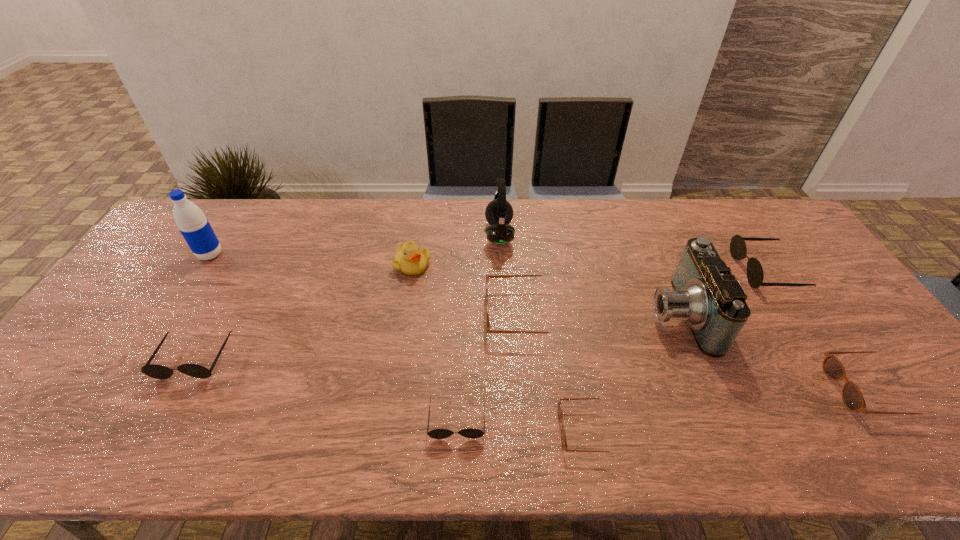
At what (x,y) coordinates should I click in order to perform the action: click on vacant space that's between the leftmost black sunglasses and the farthest black sunglasses. Please return your answer as a coordinate pair (x, y). The height and width of the screenshot is (540, 960). Looking at the image, I should click on (480, 314).

Where is `free space that is in between the rightmost black sunglasses and the duckling`? The height and width of the screenshot is (540, 960). free space that is in between the rightmost black sunglasses and the duckling is located at coordinates (588, 268).

Where is `free point between the biggest brown sunglasses and the smallest brown sunglasses`? Image resolution: width=960 pixels, height=540 pixels. free point between the biggest brown sunglasses and the smallest brown sunglasses is located at coordinates (556, 372).

I want to click on vacant space that's between the yellow duckling and the smallest brown sunglasses, so click(500, 347).

Where is `vacant area between the farthest black sunglasses and the rightmost brown sunglasses`? The width and height of the screenshot is (960, 540). vacant area between the farthest black sunglasses and the rightmost brown sunglasses is located at coordinates (817, 330).

Locate an element on the screen. the fourth closest object to the duckling is located at coordinates (155, 371).

Where is `object that ranks as the closest to the leftmost black sunglasses`? The width and height of the screenshot is (960, 540). object that ranks as the closest to the leftmost black sunglasses is located at coordinates (195, 228).

Identify the location of sunglasses that is the closest to the smallest brown sunglasses. The image size is (960, 540). (472, 433).

Find the location of a particular element. sunglasses object that ranks as the third closest to the rightmost brown sunglasses is located at coordinates [488, 330].

Locate an element on the screen. This screenshot has height=540, width=960. black sunglasses that is the closest one to the leftmost black sunglasses is located at coordinates (472, 433).